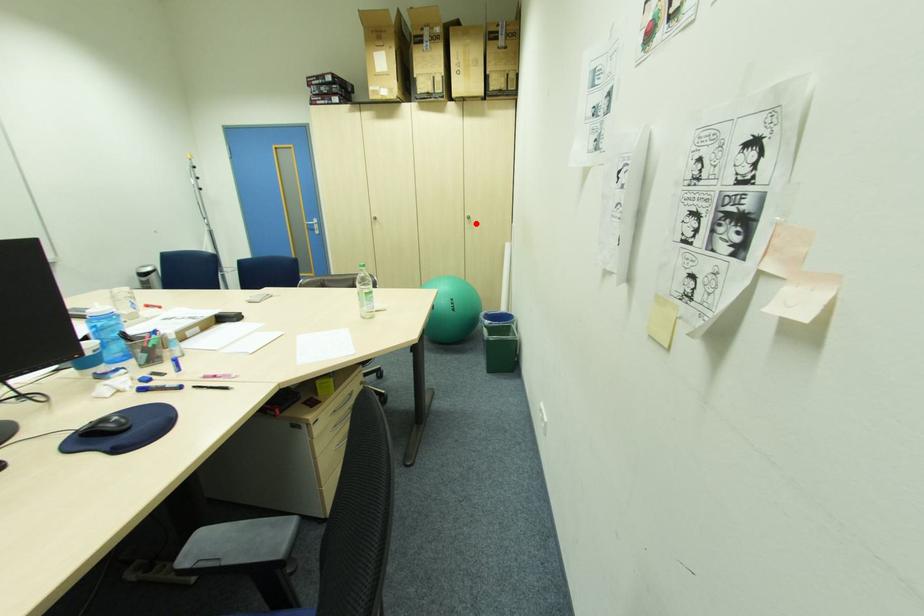
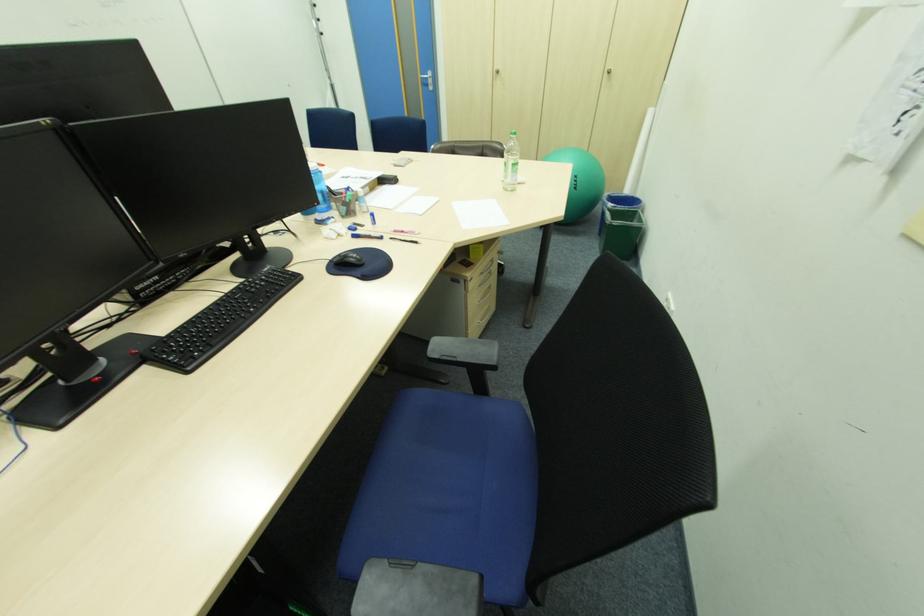
Find the pixel in the second image that matches the highlighted location in the first image.

(615, 79)